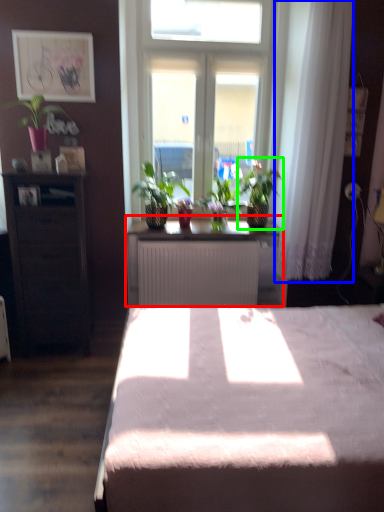
Question: Which is nearer to the table (highlighted by a red box)? curtain (highlighted by a blue box) or houseplant (highlighted by a green box).

Choices:
 (A) curtain
 (B) houseplant

Answer: (B)